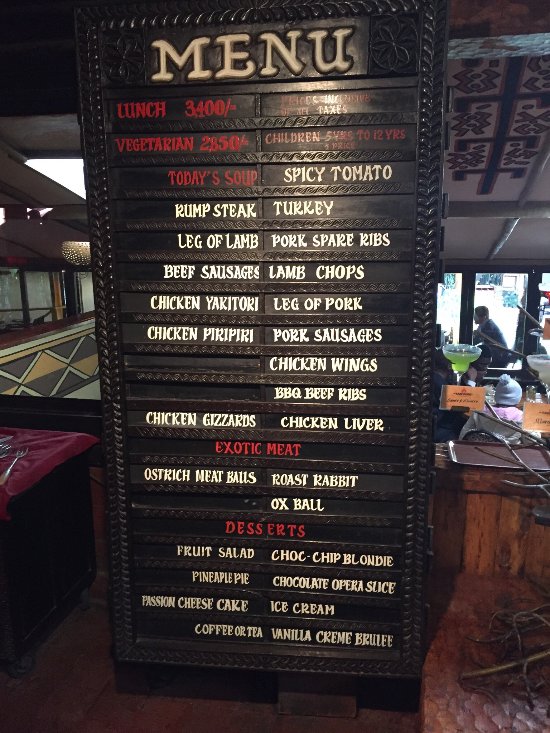
Where is `ceiling`? ceiling is located at coordinates (519, 106).